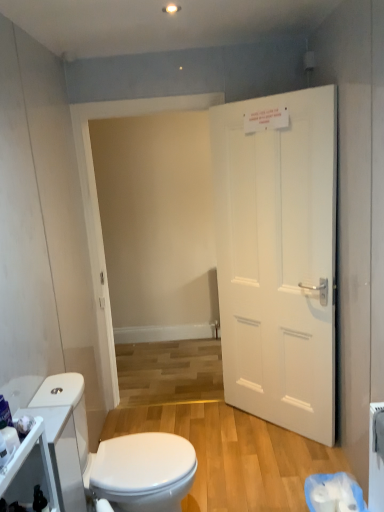
What do you see at coordinates (278, 256) in the screenshot? I see `white matte door at right` at bounding box center [278, 256].

The height and width of the screenshot is (512, 384). I want to click on white plastic toilet paper at lower right, so click(x=333, y=493).

Locate an element on the screen. Image resolution: width=384 pixels, height=512 pixels. white glossy toilet at lower left is located at coordinates (124, 457).

I want to click on white matte door at right, so click(278, 256).

Is white plastic toilet paper at lower right completely or partially inside white glossy cabinet at lower left?

No.

In the scene shown: Considering the relative positions of white glossy cabinet at lower left and white plastic toilet paper at lower right in the image provided, is white glossy cabinet at lower left in front of white plastic toilet paper at lower right?

Yes, the depth of white glossy cabinet at lower left is less than that of white plastic toilet paper at lower right.

Is white glossy cabinet at lower left wider than white plastic toilet paper at lower right?

Incorrect, the width of white glossy cabinet at lower left does not surpass that of white plastic toilet paper at lower right.

Is point (4, 477) positioned before point (316, 479)?

Yes, it is.

In the image, is white glossy cabinet at lower left positioned in front of or behind white matte door at right?

white glossy cabinet at lower left is in front of white matte door at right.

In the scene shown: Can you confirm if white glossy cabinet at lower left is positioned to the left of white matte door at right?

Result: Yes.

Is white glossy cabinet at lower left facing away from white matte door at right?

That's not correct — white glossy cabinet at lower left is not looking away from white matte door at right.

Identify the location of cabinetry on the left of white matte door at right. (26, 458).

Is there a large distance between white glossy toilet at lower left and white plastic toilet paper at lower right?

Actually, white glossy toilet at lower left and white plastic toilet paper at lower right are a little close together.

Between white glossy toilet at lower left and white plastic toilet paper at lower right, which one has more height?

white glossy toilet at lower left is taller.

At what (x,y) coordinates should I click in order to perform the action: click on toilet paper that is behind the white glossy toilet at lower left. Please return your answer as a coordinate pair (x, y). Image resolution: width=384 pixels, height=512 pixels. Looking at the image, I should click on (333, 493).

Between white glossy toilet at lower left and white plastic toilet paper at lower right, which one has larger size?

With larger size is white glossy toilet at lower left.

Which object is thinner, white plastic toilet paper at lower right or white glossy cabinet at lower left?

Thinner between the two is white glossy cabinet at lower left.

Is white plastic toilet paper at lower right not close to white glossy cabinet at lower left?

white plastic toilet paper at lower right is positioned a significant distance from white glossy cabinet at lower left.

Between white plastic toilet paper at lower right and white glossy cabinet at lower left, which one is positioned behind?

white plastic toilet paper at lower right.

From the image's perspective, which is above, white plastic toilet paper at lower right or white glossy cabinet at lower left?

white glossy cabinet at lower left.

Relative to white glossy cabinet at lower left, is white matte door at right in front or behind?

white matte door at right is positioned farther from the viewer than white glossy cabinet at lower left.

Is white matte door at right oriented towards white glossy cabinet at lower left?

Yes, white matte door at right is aimed at white glossy cabinet at lower left.

Is point (238, 303) positioned behind point (5, 475)?

Yes.

Based on the photo, from the image's perspective, is white glossy toilet at lower left on top of white glossy cabinet at lower left?

No.

Is white glossy toilet at lower left beside white glossy cabinet at lower left?

No, white glossy toilet at lower left is not with white glossy cabinet at lower left.

What's the angular difference between white glossy toilet at lower left and white glossy cabinet at lower left's facing directions?

white glossy toilet at lower left and white glossy cabinet at lower left are facing 0.933 degrees away from each other.

This screenshot has height=512, width=384. Find the location of `toilet paper below the white glossy toilet at lower left (from a real-world perspective)`. toilet paper below the white glossy toilet at lower left (from a real-world perspective) is located at coordinates (333, 493).

In terms of size, does white plastic toilet paper at lower right appear bigger or smaller than white glossy toilet at lower left?

Considering their sizes, white plastic toilet paper at lower right takes up less space than white glossy toilet at lower left.

Can you confirm if white plastic toilet paper at lower right is thinner than white glossy toilet at lower left?

Correct, the width of white plastic toilet paper at lower right is less than that of white glossy toilet at lower left.

Is white plastic toilet paper at lower right aimed at white glossy toilet at lower left?

Yes, white plastic toilet paper at lower right is facing white glossy toilet at lower left.

Identify the location of toilet paper lying below the white glossy cabinet at lower left (from the image's perspective). (x=333, y=493).

You are a GUI agent. You are given a task and a screenshot of the screen. Output one action in this format:
    pyautogui.click(x=<x>, y=<y>)
    Task: Click on the cabinetry that is in front of the white matte door at right
    Image resolution: width=384 pixels, height=512 pixels.
    Given the screenshot: What is the action you would take?
    pyautogui.click(x=26, y=458)

Looking at the image, which one is located further to white glossy toilet at lower left, white matte door at right or white plastic toilet paper at lower right?

white matte door at right.

Based on the photo, estimate the real-world distances between objects in this image. Which object is closer to white plastic toilet paper at lower right, white glossy toilet at lower left or white glossy cabinet at lower left?

Among the two, white glossy toilet at lower left is located nearer to white plastic toilet paper at lower right.

Looking at the image, which one is located further to white glossy toilet at lower left, white plastic toilet paper at lower right or white glossy cabinet at lower left?

The object further to white glossy toilet at lower left is white plastic toilet paper at lower right.

From the image, which object appears to be farther from white matte door at right, white glossy cabinet at lower left or white glossy toilet at lower left?

white glossy cabinet at lower left.

Based on their spatial positions, is white glossy cabinet at lower left or white plastic toilet paper at lower right closer to white matte door at right?

The object closer to white matte door at right is white plastic toilet paper at lower right.

Based on their spatial positions, is white plastic toilet paper at lower right or white matte door at right further from white glossy cabinet at lower left?

white matte door at right is further to white glossy cabinet at lower left.

Looking at the image, which one is located closer to white plastic toilet paper at lower right, white glossy toilet at lower left or white matte door at right?

white glossy toilet at lower left.

Based on their spatial positions, is white matte door at right or white glossy cabinet at lower left closer to white plastic toilet paper at lower right?

white matte door at right is positioned closer to the anchor white plastic toilet paper at lower right.

Where is `toilet situated between white glossy cabinet at lower left and white plastic toilet paper at lower right from left to right`? toilet situated between white glossy cabinet at lower left and white plastic toilet paper at lower right from left to right is located at coordinates (124, 457).

Locate an element on the screen. This screenshot has width=384, height=512. door located between white glossy cabinet at lower left and white plastic toilet paper at lower right in the left-right direction is located at coordinates (278, 256).

You are a GUI agent. You are given a task and a screenshot of the screen. Output one action in this format:
    pyautogui.click(x=<x>, y=<y>)
    Task: Click on the toilet between white glossy cabinet at lower left and white matte door at right in the horizontal direction
    The width and height of the screenshot is (384, 512).
    Given the screenshot: What is the action you would take?
    pyautogui.click(x=124, y=457)

Identify the location of toilet between white matte door at right and white plastic toilet paper at lower right from top to bottom. Image resolution: width=384 pixels, height=512 pixels. (124, 457).